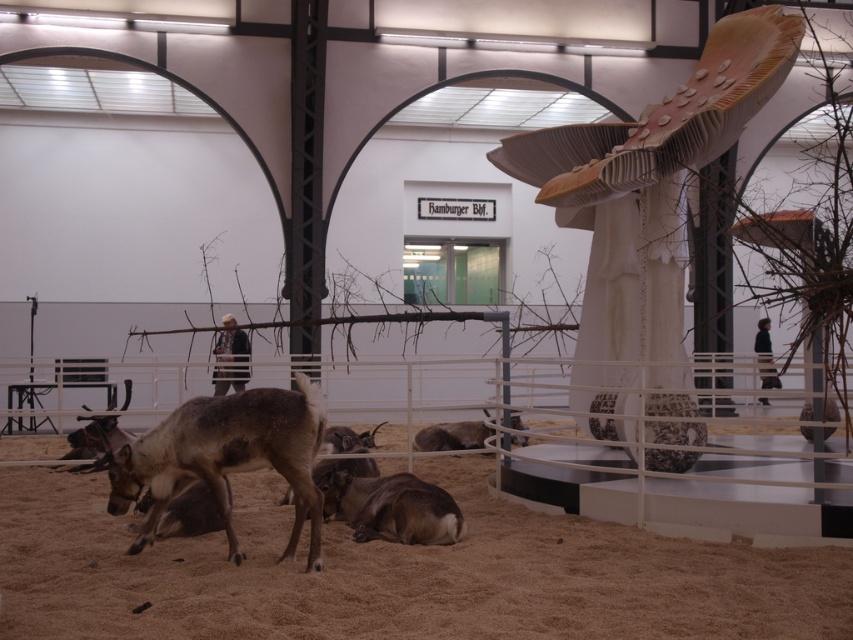
Is brown sandy ground at lower center to the left of wooden sculpture at center from the viewer's perspective?

Correct, you'll find brown sandy ground at lower center to the left of wooden sculpture at center.

Does brown sandy ground at lower center have a lesser height compared to wooden sculpture at center?

Result: Yes.

Which is behind, point (16, 605) or point (670, 157)?

The point (670, 157) is behind.

Locate an element on the screen. The width and height of the screenshot is (853, 640). brown sandy ground at lower center is located at coordinates (396, 573).

Does wooden sculpture at center appear on the right side of brown fur deer at center?

Yes, wooden sculpture at center is to the right of brown fur deer at center.

Looking at this image, does wooden sculpture at center have a greater width compared to brown fur deer at center?

Yes.

Does point (674, 124) lie behind point (181, 470)?

That is True.

Where is `wooden sculpture at center`? The width and height of the screenshot is (853, 640). wooden sculpture at center is located at coordinates (648, 205).

The width and height of the screenshot is (853, 640). What are the coordinates of `brown sandy ground at lower center` in the screenshot? It's located at (396, 573).

Between brown sandy ground at lower center and brown fur deer at center, which one has less height?

brown sandy ground at lower center is shorter.

Find the location of a particular element. The height and width of the screenshot is (640, 853). brown sandy ground at lower center is located at coordinates (396, 573).